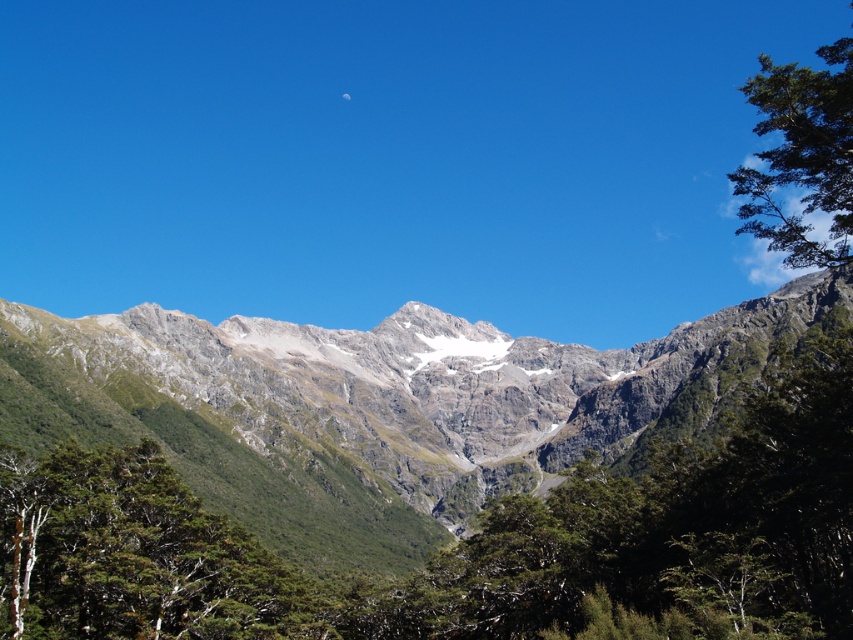
You are a hiker standing at the trailhead and see the rugged granite mountain range at center and the green leafy tree at lower left in the distance. Which object appears wider from your perspective?

The rugged granite mountain range at center appears wider than the green leafy tree at lower left because its width surpasses that of the tree.

You are an outdoor photographer planning to capture the rugged granite mountain range at center and the green leafy tree at lower left in a single shot. Based on their sizes, which object should you focus on first to ensure both are in frame?

The rugged granite mountain range at center is larger in size than the green leafy tree at lower left, so you should focus on the rugged granite mountain range at center first to ensure both are in frame.